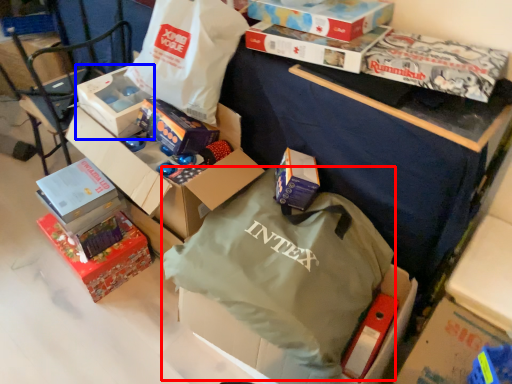
Question: Which object appears farthest to the camera in this image, bag (highlighted by a red box) or box (highlighted by a blue box)?

Choices:
 (A) bag
 (B) box

Answer: (B)